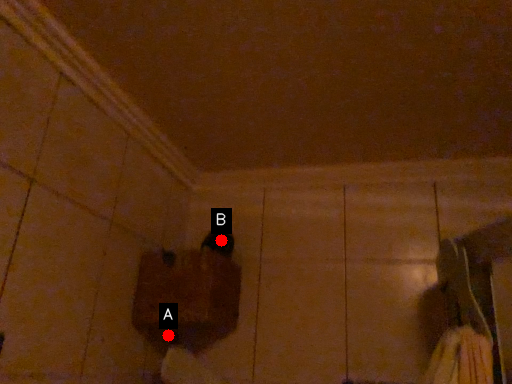
Question: Two points are circled on the image, labeled by A and B beside each circle. Among these points, which one is nearest to the camera?

Choices:
 (A) A is closer
 (B) B is closer

Answer: (A)